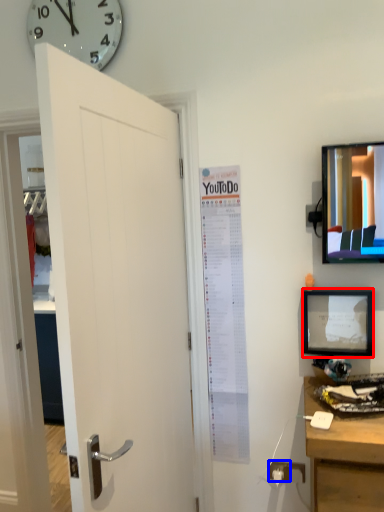
Question: Which object is further to the camera taking this photo, picture frame (highlighted by a red box) or electric outlet (highlighted by a blue box)?

Choices:
 (A) picture frame
 (B) electric outlet

Answer: (B)